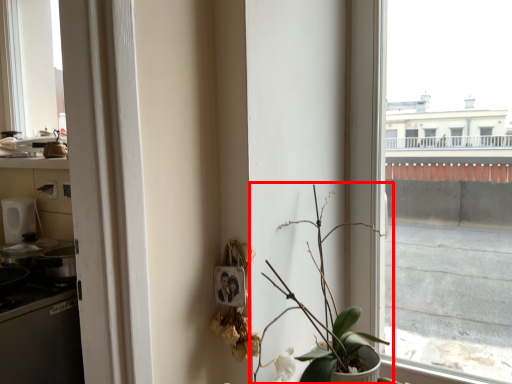
Question: Observing the image, what is the correct spatial positioning of houseplant (annotated by the red box) in reference to window?

Choices:
 (A) right
 (B) left

Answer: (B)